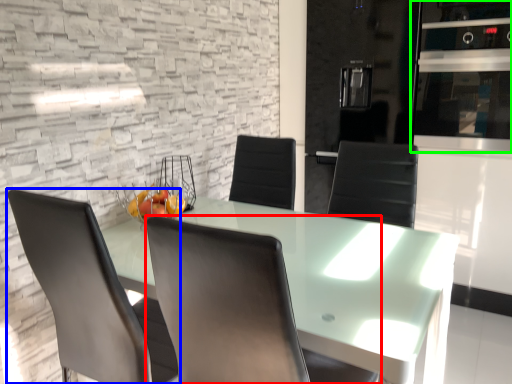
Question: Which is nearer to the chair (highlighted by a red box)? chair (highlighted by a blue box) or appliance (highlighted by a green box).

Choices:
 (A) chair
 (B) appliance

Answer: (A)